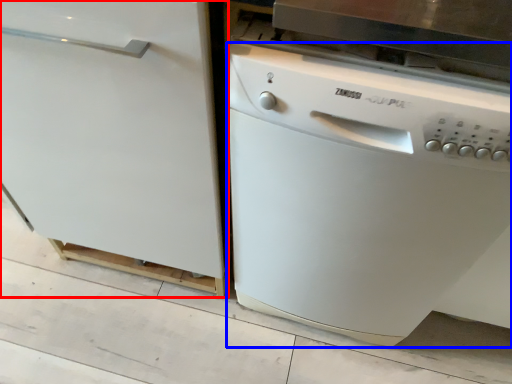
Question: Which of the following is the farthest to the observer, home appliance (highlighted by a red box) or dish washer (highlighted by a blue box)?

Choices:
 (A) home appliance
 (B) dish washer

Answer: (A)